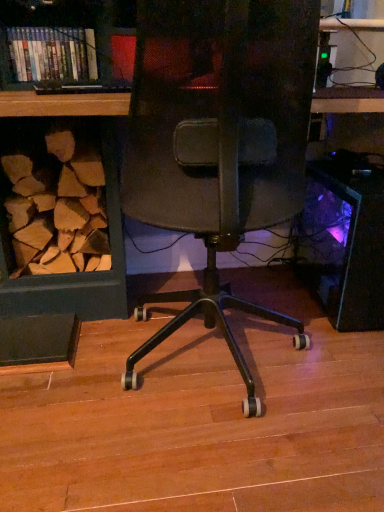
Question: From a real-world perspective, relative to black plastic desktop at right, is hardcover books at upper left vertically above or below?

Choices:
 (A) above
 (B) below

Answer: (A)

Question: Is hardcover books at upper left in front of or behind black plastic desktop at right in the image?

Choices:
 (A) behind
 (B) front

Answer: (A)

Question: Looking at their shapes, would you say hardcover books at upper left is wider or thinner than black plastic desktop at right?

Choices:
 (A) thin
 (B) wide

Answer: (A)

Question: Is black plastic desktop at right spatially inside hardcover books at upper left, or outside of it?

Choices:
 (A) outside
 (B) inside

Answer: (A)

Question: Is black plastic desktop at right wider or thinner than hardcover books at upper left?

Choices:
 (A) wide
 (B) thin

Answer: (A)

Question: From a real-world perspective, is black plastic desktop at right physically located above or below hardcover books at upper left?

Choices:
 (A) above
 (B) below

Answer: (B)

Question: From the image's perspective, is black plastic desktop at right above or below hardcover books at upper left?

Choices:
 (A) below
 (B) above

Answer: (A)